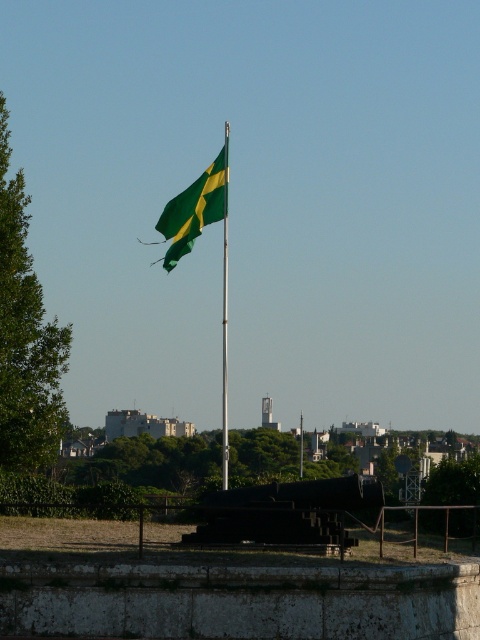
You are a park visitor holding a kite. You want to fly it near the green matte flag at center and the silver metallic pole at center. Since the flag is flying, will your kite be visible above it if you fly it at the same height?

The green matte flag at center is positioned over the silver metallic pole at center, so if you fly your kite at the same height as the flag, it might be partially or fully obscured by the flag depending on the exact positioning. To ensure visibility, you should fly the kite higher than the flag.

You are standing at the center of the image and want to find the green matte flag at center. According to the coordinates provided, in which direction should you look to locate it?

The green matte flag at center is located at coordinates point (194, 209), which means it is slightly to the left and above the exact center point of the image.